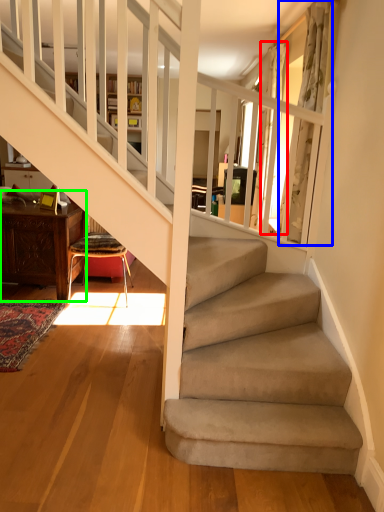
Question: Estimate the real-world distances between objects in this image. Which object is closer to curtain (highlighted by a red box), curtain (highlighted by a blue box) or table (highlighted by a green box)?

Choices:
 (A) curtain
 (B) table

Answer: (A)